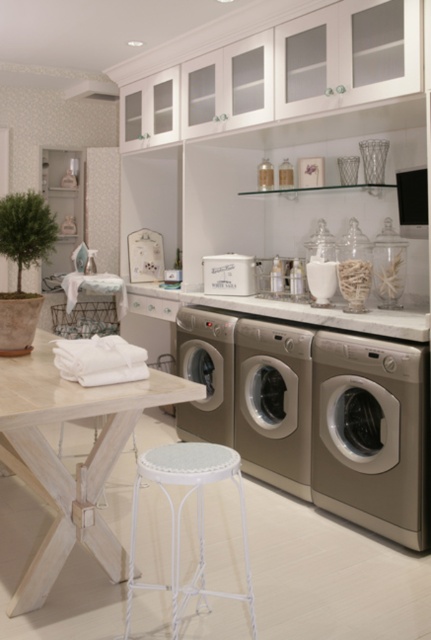
Question: Is satin silver washing machine at center above white metal stool at lower center?

Choices:
 (A) no
 (B) yes

Answer: (B)

Question: Among these objects, which one is farthest from the camera?

Choices:
 (A) white matte container at center
 (B) white wood table at center
 (C) white metal stool at lower center
 (D) satin silver washer at lower right

Answer: (A)

Question: Which of the following is the closest to the observer?

Choices:
 (A) (38, 380)
 (B) (112, 376)
 (C) (255, 369)

Answer: (B)

Question: Estimate the real-world distances between objects in this image. Which object is closer to the white soft towels at center?

Choices:
 (A) white wood table at center
 (B) white metal stool at lower center

Answer: (A)

Question: Is white soft towels at center smaller than white matte container at center?

Choices:
 (A) no
 (B) yes

Answer: (A)

Question: Does satin silver washer at lower right come behind white matte container at center?

Choices:
 (A) yes
 (B) no

Answer: (B)